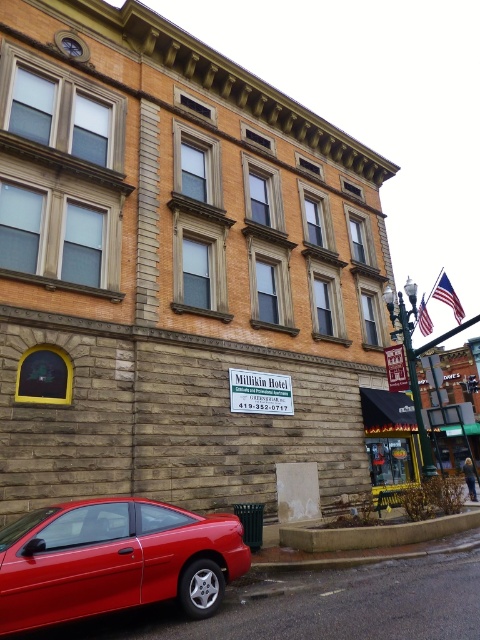
Between matte red car at lower left and metallic gold street sign at center, which one is positioned lower?

matte red car at lower left

Can you confirm if matte red car at lower left is positioned above metallic gold street sign at center?

Incorrect, matte red car at lower left is not positioned above metallic gold street sign at center.

Is point (14, 566) less distant than point (409, 333)?

Yes.

Locate an element on the screen. The image size is (480, 640). matte red car at lower left is located at coordinates (115, 561).